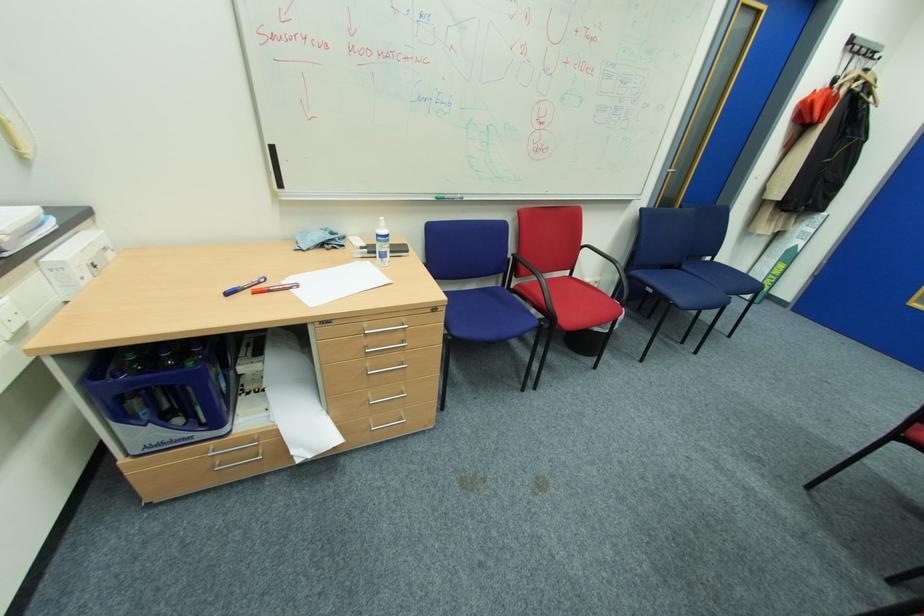
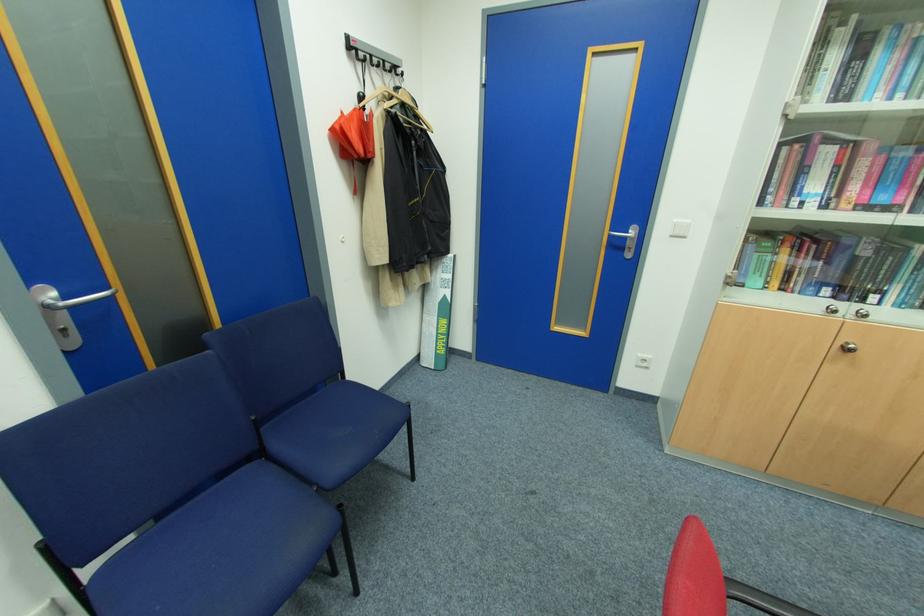
Question: I am providing you with two images of the same scene from different viewpoints. After the viewpoint changes to image2, which objects are now occluded?

Choices:
 (A) red umbrella
 (B) white power outlet
 (C) silver door handle
 (D) none of these

Answer: (D)